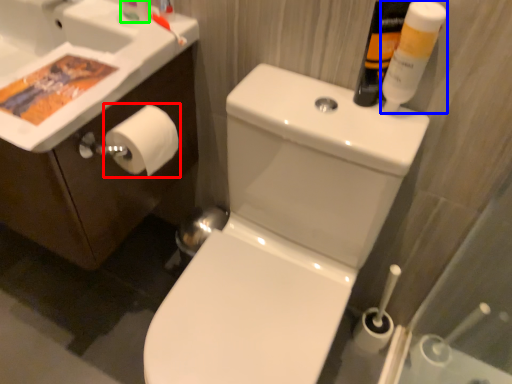
Question: Estimate the real-world distances between objects in this image. Which object is farther from toilet paper (highlighted by a red box), mouthwash (highlighted by a blue box) or toiletry (highlighted by a green box)?

Choices:
 (A) mouthwash
 (B) toiletry

Answer: (A)